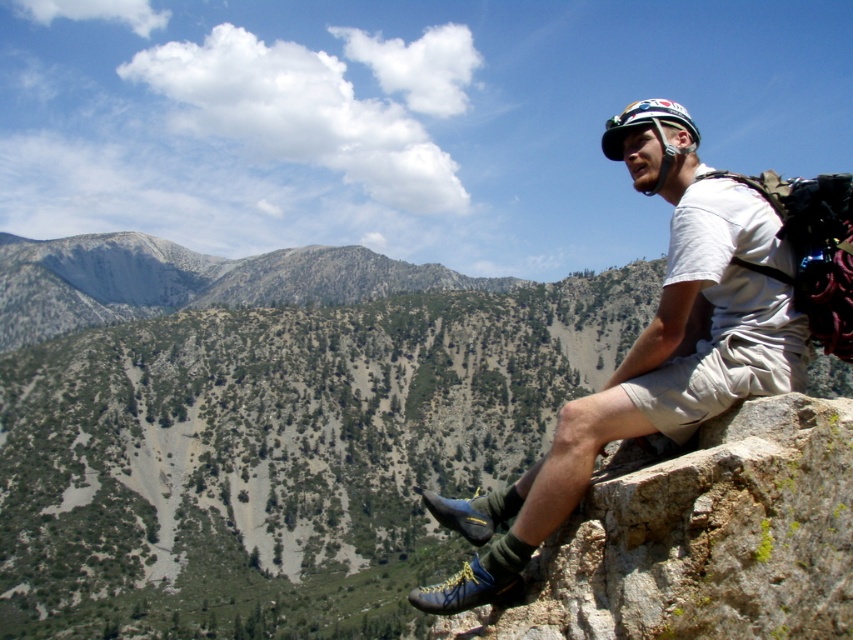
Question: From the image, what is the correct spatial relationship of brown rough rock at lower right in relation to matte white helmet at upper right?

Choices:
 (A) below
 (B) above

Answer: (B)

Question: Which of the following is the closest to the observer?

Choices:
 (A) brown rough rock at lower right
 (B) matte white helmet at upper right

Answer: (A)

Question: Which object is farther from the camera taking this photo?

Choices:
 (A) matte white helmet at upper right
 (B) brown rough rock at lower right

Answer: (A)

Question: Can you confirm if brown rough rock at lower right is positioned to the right of matte white helmet at upper right?

Choices:
 (A) yes
 (B) no

Answer: (B)

Question: Observing the image, what is the correct spatial positioning of brown rough rock at lower right in reference to matte white helmet at upper right?

Choices:
 (A) below
 (B) above

Answer: (B)